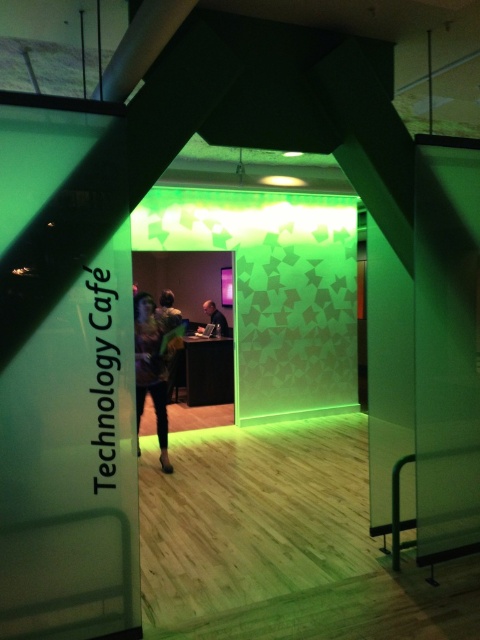
Which of these two, patterned fabric dress at center or matte black laptop at center, stands taller?

patterned fabric dress at center

Does patterned fabric dress at center appear under matte black laptop at center?

Yes.

Is point (143, 332) closer to viewer compared to point (213, 317)?

Yes, it is in front of point (213, 317).

At what (x,y) coordinates should I click in order to perform the action: click on patterned fabric dress at center. Please return your answer as a coordinate pair (x, y). The width and height of the screenshot is (480, 640). Looking at the image, I should click on (153, 365).